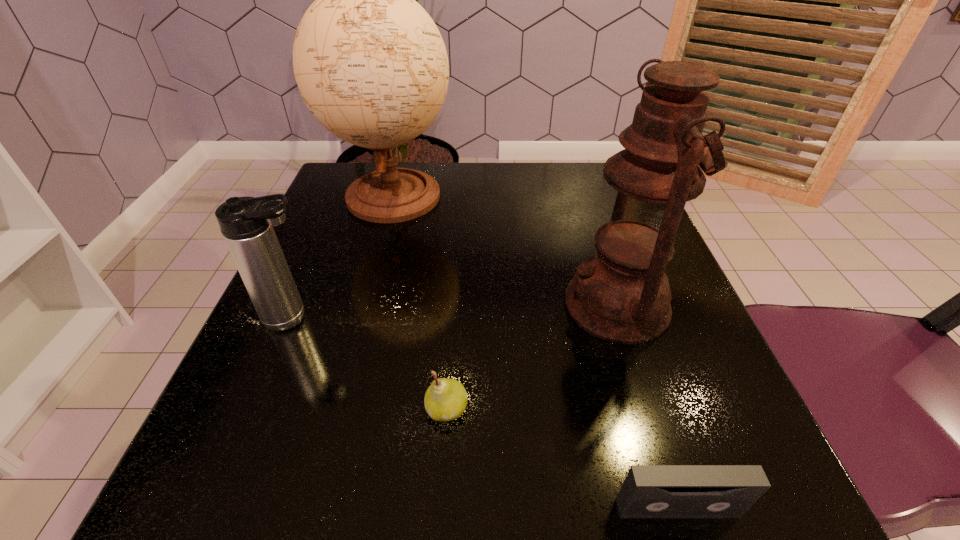
Where is `vacant area between the oil lamp and the nearest object`? This screenshot has height=540, width=960. vacant area between the oil lamp and the nearest object is located at coordinates (647, 407).

At what (x,y) coordinates should I click in order to perform the action: click on vacant area that lies between the thermos bottle and the oil lamp. Please return your answer as a coordinate pair (x, y). Image resolution: width=960 pixels, height=540 pixels. Looking at the image, I should click on (456, 312).

The height and width of the screenshot is (540, 960). In order to click on empty location between the second nearest object and the nearest object in this screenshot , I will do `click(562, 459)`.

I want to click on free spot between the fourth farthest object and the nearest object, so click(562, 459).

Locate an element on the screen. This screenshot has width=960, height=540. free space between the nearest object and the second tallest object is located at coordinates (647, 407).

The width and height of the screenshot is (960, 540). Identify the location of empty space between the fourth shortest object and the videotape. (647, 407).

Where is `object that is the third closest to the tallest object`? object that is the third closest to the tallest object is located at coordinates (445, 400).

Locate which object ranks in proximity to the videotape. Please provide its 2D coordinates. Your answer should be formatted as a tuple, i.e. [(x, y)], where the tuple contains the x and y coordinates of a point satisfying the conditions above.

[(445, 400)]

In order to click on free spot that satisfies the following two spatial constraints: 1. on the surface of the globe; 2. on the right side of the second nearest object in this screenshot , I will do pyautogui.click(x=336, y=409).

I want to click on free space that satisfies the following two spatial constraints: 1. on the surface of the fourth farthest object; 2. on the right side of the globe, so click(x=336, y=409).